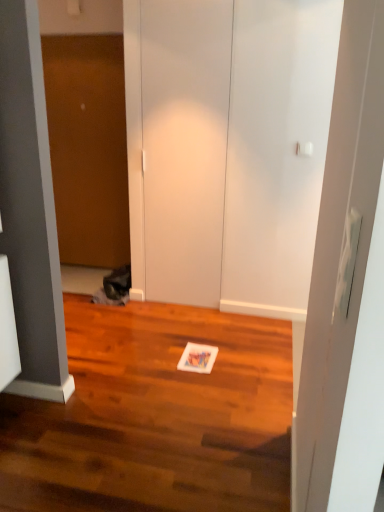
This screenshot has width=384, height=512. Describe the element at coordinates (88, 147) in the screenshot. I see `wooden door at left, which ranks as the 1th door in left-to-right order` at that location.

You are a GUI agent. You are given a task and a screenshot of the screen. Output one action in this format:
    pyautogui.click(x=<x>, y=<y>)
    Task: Click on the wooden door at left, which ranks as the 2th door in right-to-left order
    
    Given the screenshot: What is the action you would take?
    pyautogui.click(x=88, y=147)

What do you see at coordinates (184, 145) in the screenshot?
I see `white matte door at center, the first door from the front` at bounding box center [184, 145].

Locate an element on the screen. The height and width of the screenshot is (512, 384). white matte door at center, the first door from the front is located at coordinates (184, 145).

This screenshot has width=384, height=512. In order to click on wooden door at left, which is counted as the 1th door, starting from the back in this screenshot , I will do (x=88, y=147).

Is wooden door at left, which is counted as the 1th door, starting from the back, to the right of white matte door at center, acting as the 1th door starting from the right, from the viewer's perspective?

No, wooden door at left, which is counted as the 1th door, starting from the back, is not to the right of white matte door at center, acting as the 1th door starting from the right.

Is wooden door at left, which ranks as the 2th door in right-to-left order, in front of white matte door at center, acting as the 1th door starting from the right?

No, it is not.

Is point (103, 48) positioned after point (180, 137)?

Yes, it is.

From the image's perspective, is wooden door at left, the second door from the front, located above white matte door at center, the first door from the front?

Yes, from the image's perspective, wooden door at left, the second door from the front, is over white matte door at center, the first door from the front.

From a real-world perspective, relative to white matte door at center, the 2th door from the left, is wooden door at left, the second door from the front, vertically above or below?

Clearly, from a real-world perspective, wooden door at left, the second door from the front, is below white matte door at center, the 2th door from the left.

Does wooden door at left, which is counted as the 1th door, starting from the back, have a lesser width compared to white matte door at center, the 2th door from the left?

Incorrect, the width of wooden door at left, which is counted as the 1th door, starting from the back, is not less than that of white matte door at center, the 2th door from the left.

Can you confirm if wooden door at left, the second door from the front, is shorter than white matte door at center, the first door from the front?

Yes, wooden door at left, the second door from the front, is shorter than white matte door at center, the first door from the front.

Is wooden door at left, which ranks as the 1th door in left-to-right order, bigger or smaller than white matte door at center, the 2th door from the left?

Clearly, wooden door at left, which ranks as the 1th door in left-to-right order, is larger in size than white matte door at center, the 2th door from the left.

Is wooden door at left, which ranks as the 2th door in right-to-left order, completely or partially outside of white matte door at center, the 2th door from the left?

Yes, wooden door at left, which ranks as the 2th door in right-to-left order, is located beyond the bounds of white matte door at center, the 2th door from the left.

Is wooden door at left, which ranks as the 1th door in left-to-right order, positioned far away from white matte door at center, acting as the second door starting from the back?

No, wooden door at left, which ranks as the 1th door in left-to-right order, is not far away from white matte door at center, acting as the second door starting from the back.

Is wooden door at left, which ranks as the 1th door in left-to-right order, facing away from white matte door at center, acting as the 1th door starting from the right?

No.

Measure the distance from wooden door at left, which is counted as the 1th door, starting from the back, to white matte door at center, the first door from the front.

The distance of wooden door at left, which is counted as the 1th door, starting from the back, from white matte door at center, the first door from the front, is 37.62 inches.

Find the location of a particular element. This screenshot has height=512, width=384. door that appears above the wooden door at left, which is counted as the 1th door, starting from the back (from a real-world perspective) is located at coordinates (184, 145).

Which is more to the right, white matte door at center, the first door from the front, or wooden door at left, which is counted as the 1th door, starting from the back?

white matte door at center, the first door from the front, is more to the right.

Does white matte door at center, the first door from the front, come in front of wooden door at left, which is counted as the 1th door, starting from the back?

Yes, white matte door at center, the first door from the front, is closer to the camera.

Is point (188, 95) positioned before point (91, 112)?

That is True.

From the image's perspective, which object appears higher, white matte door at center, acting as the second door starting from the back, or wooden door at left, which is counted as the 1th door, starting from the back?

wooden door at left, which is counted as the 1th door, starting from the back, is shown above in the image.

Consider the image. From a real-world perspective, is white matte door at center, acting as the 1th door starting from the right, physically above wooden door at left, which is counted as the 1th door, starting from the back?

Yes, from a real-world perspective, white matte door at center, acting as the 1th door starting from the right, is over wooden door at left, which is counted as the 1th door, starting from the back

Can you confirm if white matte door at center, acting as the second door starting from the back, is wider than wooden door at left, which ranks as the 1th door in left-to-right order?

Incorrect, the width of white matte door at center, acting as the second door starting from the back, does not surpass that of wooden door at left, which ranks as the 1th door in left-to-right order.

Between white matte door at center, acting as the second door starting from the back, and wooden door at left, the second door from the front, which one has less height?

Standing shorter between the two is wooden door at left, the second door from the front.

Who is bigger, white matte door at center, acting as the second door starting from the back, or wooden door at left, which ranks as the 2th door in right-to-left order?

wooden door at left, which ranks as the 2th door in right-to-left order, is bigger.

Is wooden door at left, which ranks as the 2th door in right-to-left order, inside white matte door at center, the 2th door from the left?

No, wooden door at left, which ranks as the 2th door in right-to-left order, is located outside of white matte door at center, the 2th door from the left.

Based on the photo, is white matte door at center, the 2th door from the left, far away from wooden door at left, which ranks as the 1th door in left-to-right order?

No.

In the scene shown: Could you tell me if white matte door at center, the first door from the front, is turned towards wooden door at left, the second door from the front?

No, white matte door at center, the first door from the front, does not turn towards wooden door at left, the second door from the front.

Identify the location of door located on the left of white matte door at center, acting as the 1th door starting from the right. click(x=88, y=147).

Find the location of `door below the wooden door at left, which is counted as the 1th door, starting from the back (from the image's perspective)`. door below the wooden door at left, which is counted as the 1th door, starting from the back (from the image's perspective) is located at coordinates (184, 145).

The width and height of the screenshot is (384, 512). I want to click on door in front of the wooden door at left, which is counted as the 1th door, starting from the back, so click(x=184, y=145).